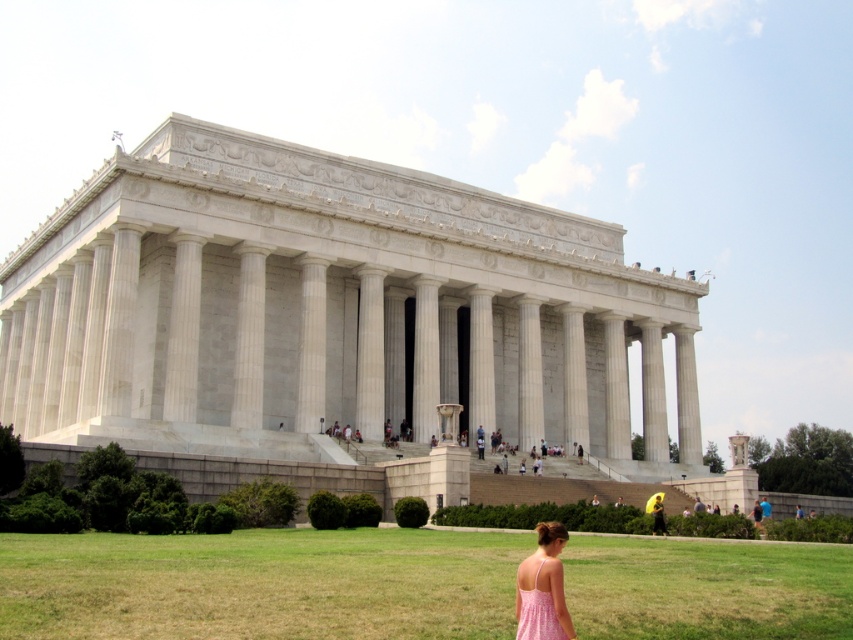
You are a photographer planning to take a picture of the Lincoln Memorial. You notice two dresses in the foreground, a pink floral dress at lower right and a pink fabric dress at lower center. Which dress should you avoid including in your shot to ensure the Lincoln Memorial remains the main focus?

To keep the Lincoln Memorial as the main focus, avoid including the pink fabric dress at lower center because it occupies more space and might distract from the memorial.

You are standing at the base of the Lincoln Memorial steps and see two dresses in the foreground. Which dress is nearer to you, the pink floral dress at lower right or the pink fabric dress at lower center?

The pink floral dress at lower right is closer to the viewer than the pink fabric dress at lower center, so the pink floral dress at lower right is nearer to you.

You are a photographer standing at the base of the Lincoln Memorial steps. You want to capture a photo that includes both the green grass at lower center and the pink fabric dress at lower center. What is the minimum distance you need to move backward to ensure both objects are in frame?

The green grass at lower center and the pink fabric dress at lower center are 20.63 meters apart. To include both in the photo, you need to move backward until you are at least 20.63 meters away from the closer object, ensuring the entire distance between them fits within your camera frame.